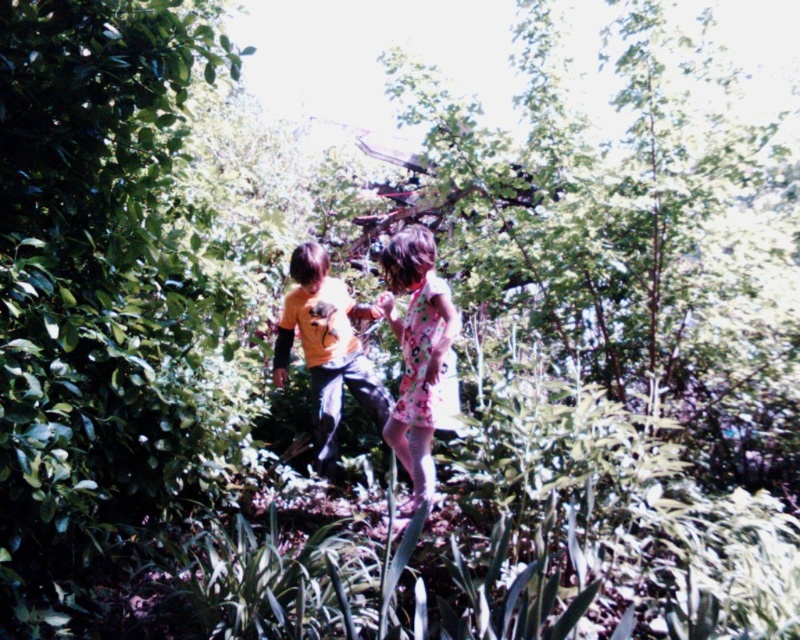
Does floral dress at center appear on the right side of orange matte shirt at center?

Indeed, floral dress at center is positioned on the right side of orange matte shirt at center.

Who is more distant from viewer, (408, 228) or (340, 387)?

Point (340, 387)

Locate an element on the screen. The width and height of the screenshot is (800, 640). floral dress at center is located at coordinates (420, 356).